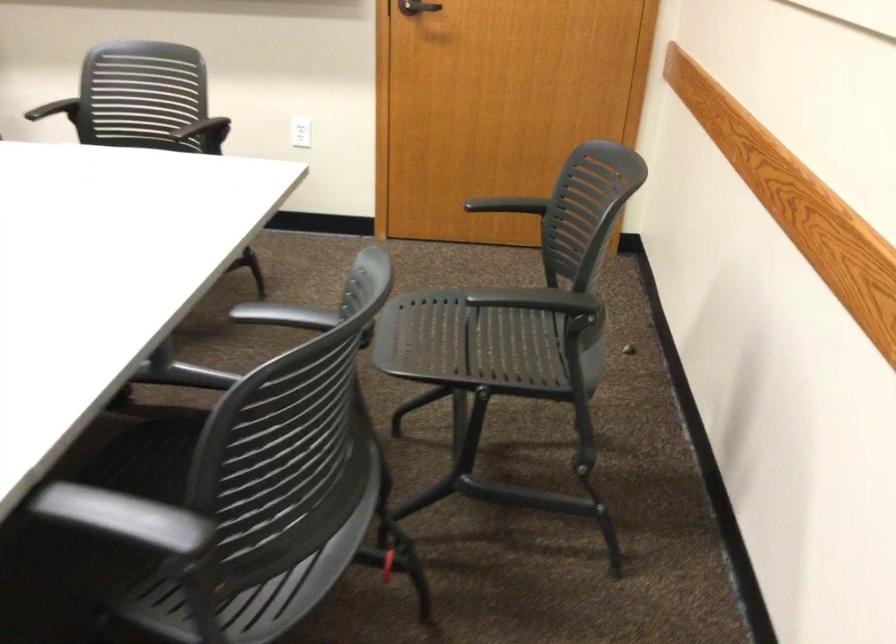
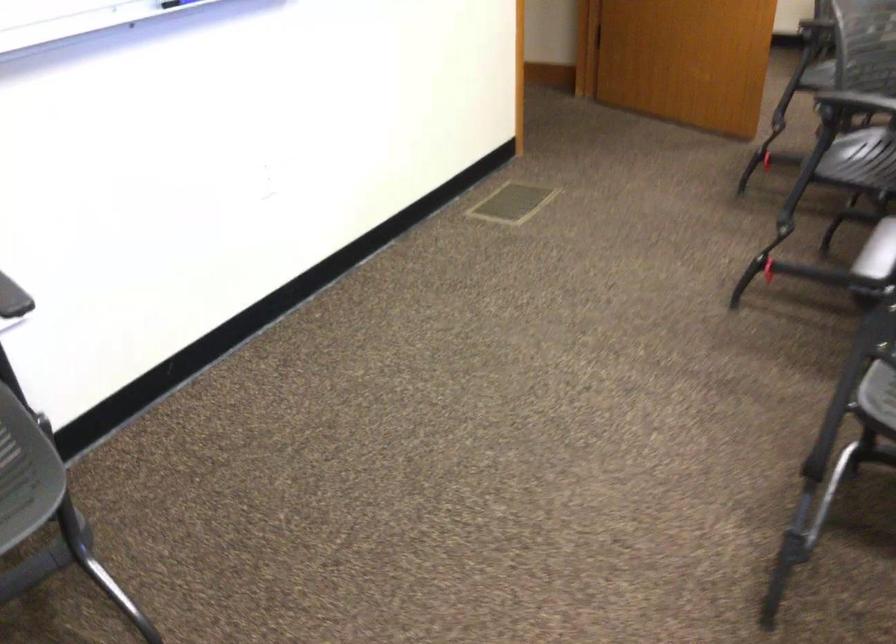
In a continuous first-person perspective shot, in which direction is the camera moving?

The cameraman walked toward left, backward.